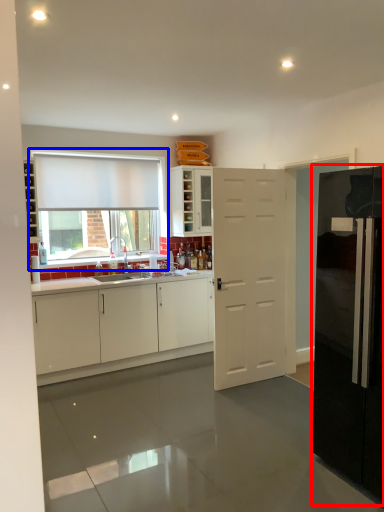
Question: Which object appears closest to the camera in this image, refrigerator (highlighted by a red box) or window (highlighted by a blue box)?

Choices:
 (A) refrigerator
 (B) window

Answer: (A)